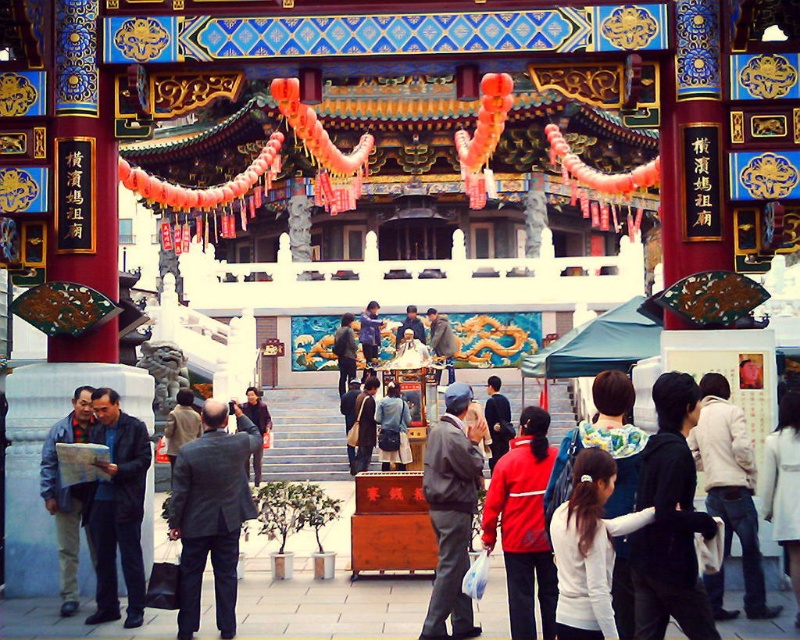
You are a photographer standing at the entrance of the temple. You need to capture both the white wool coat at lower right and the dark gray fabric jacket at center in a single shot. Which of the two items should you focus on first to ensure both are in frame?

You should focus on the dark gray fabric jacket at center first because it is taller than the white wool coat at lower right, ensuring both will fit within the frame when centered.